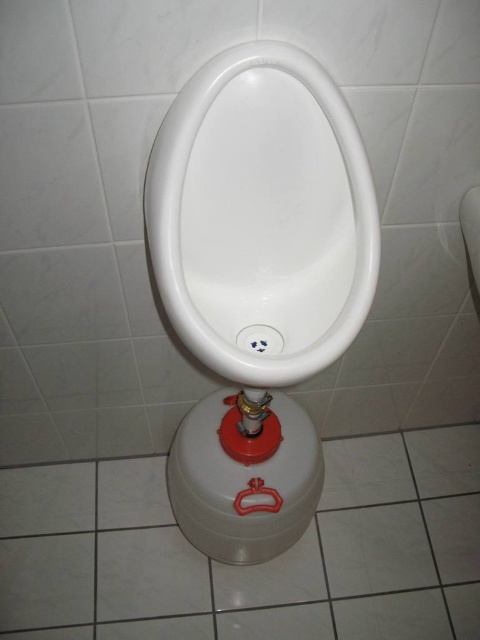
Question: Considering the relative positions of white glossy urinal at center and white glossy toilet bowl at center in the image provided, where is white glossy urinal at center located with respect to white glossy toilet bowl at center?

Choices:
 (A) above
 (B) below

Answer: (A)

Question: Is white glossy urinal at center bigger than white glossy toilet bowl at center?

Choices:
 (A) yes
 (B) no

Answer: (B)

Question: Which point is closer to the camera?

Choices:
 (A) white glossy toilet bowl at center
 (B) white glossy urinal at center

Answer: (B)

Question: Which point appears farthest from the camera in this image?

Choices:
 (A) tap(238, 120)
 (B) tap(200, 428)

Answer: (B)

Question: Which point is farther to the camera?

Choices:
 (A) white glossy toilet bowl at center
 (B) white glossy urinal at center

Answer: (A)

Question: Can you confirm if white glossy urinal at center is positioned above white glossy toilet bowl at center?

Choices:
 (A) no
 (B) yes

Answer: (B)